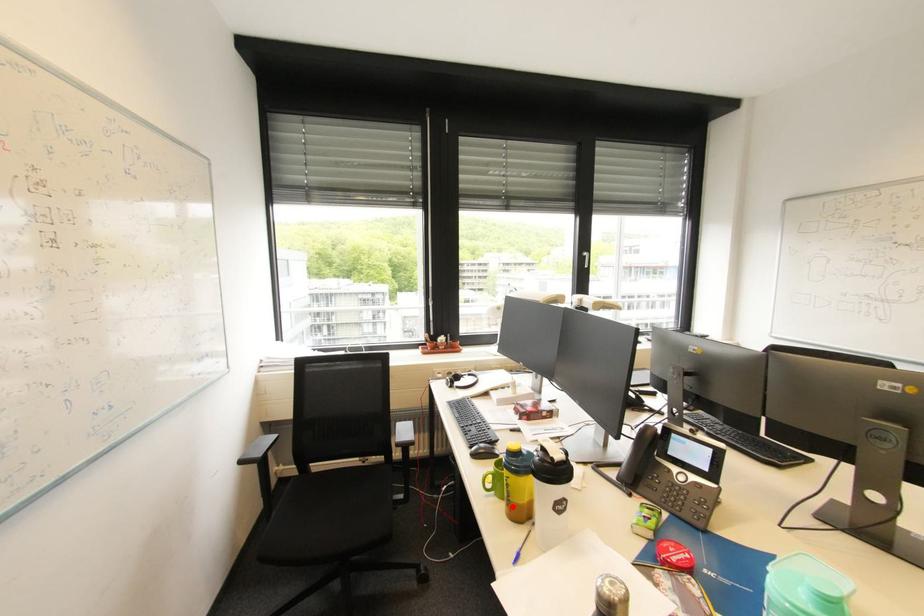
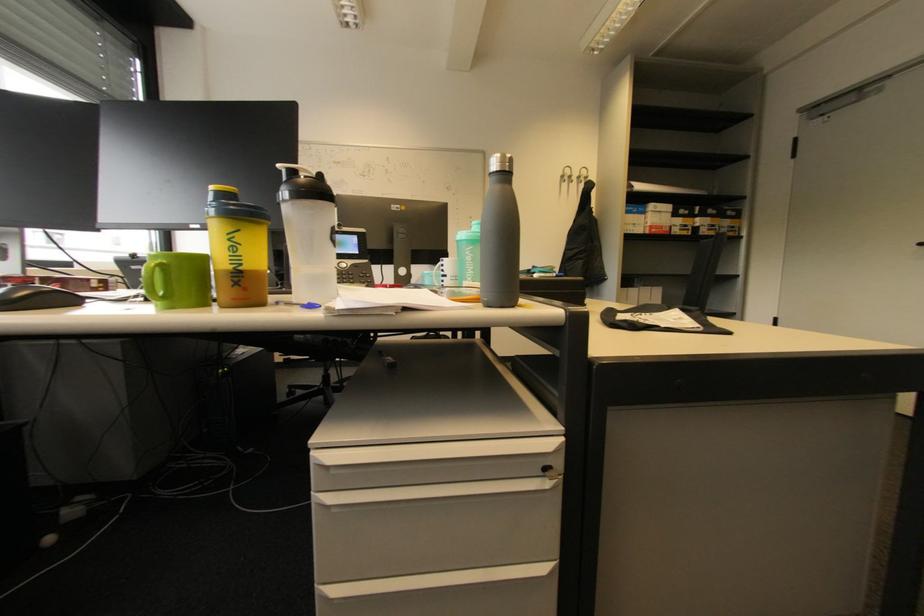
Locate, in the second image, the point that corresponds to the highlighted location in the first image.

(239, 286)